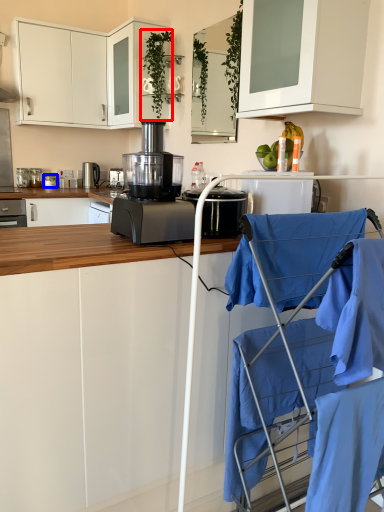
Question: Which object is further to the camera taking this photo, plant (highlighted by a red box) or kitchen appliance (highlighted by a blue box)?

Choices:
 (A) plant
 (B) kitchen appliance

Answer: (B)